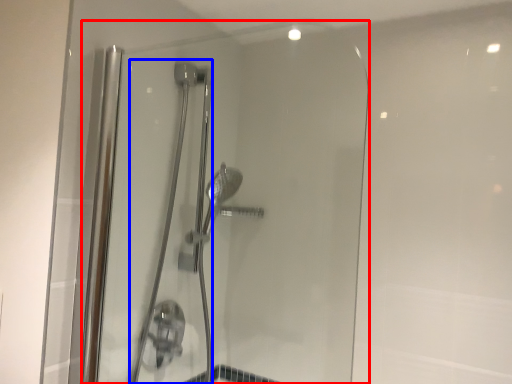
Question: Which object appears farthest to the camera in this image, shower door (highlighted by a red box) or shower door (highlighted by a blue box)?

Choices:
 (A) shower door
 (B) shower door

Answer: (B)